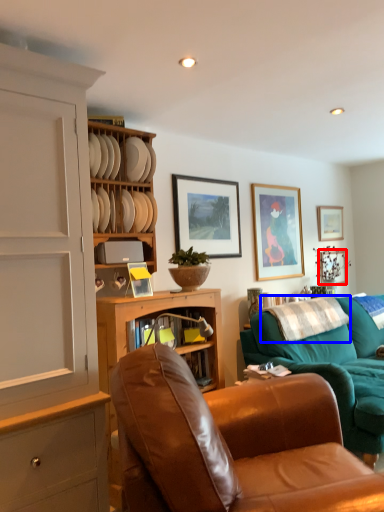
Question: Which object appears closest to the camera in this image, picture frame (highlighted by a red box) or pillow (highlighted by a blue box)?

Choices:
 (A) picture frame
 (B) pillow

Answer: (B)